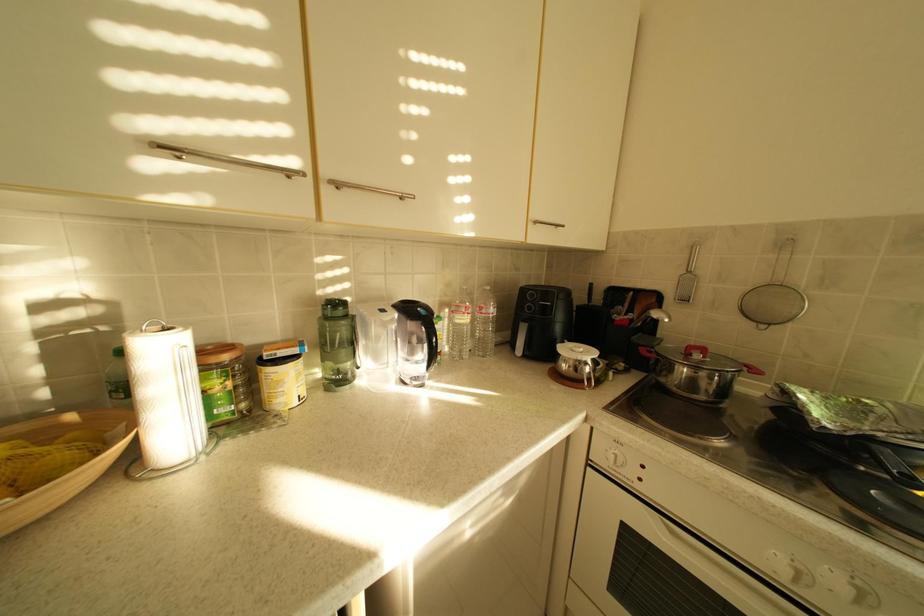
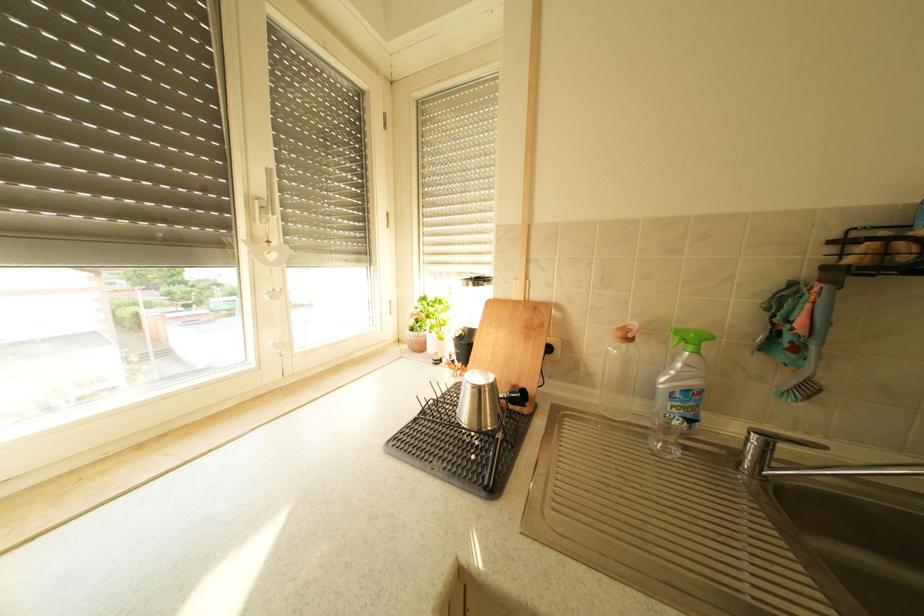
Based on the continuous images, in which direction is the camera rotating?

The rotation direction of the camera is right-down.